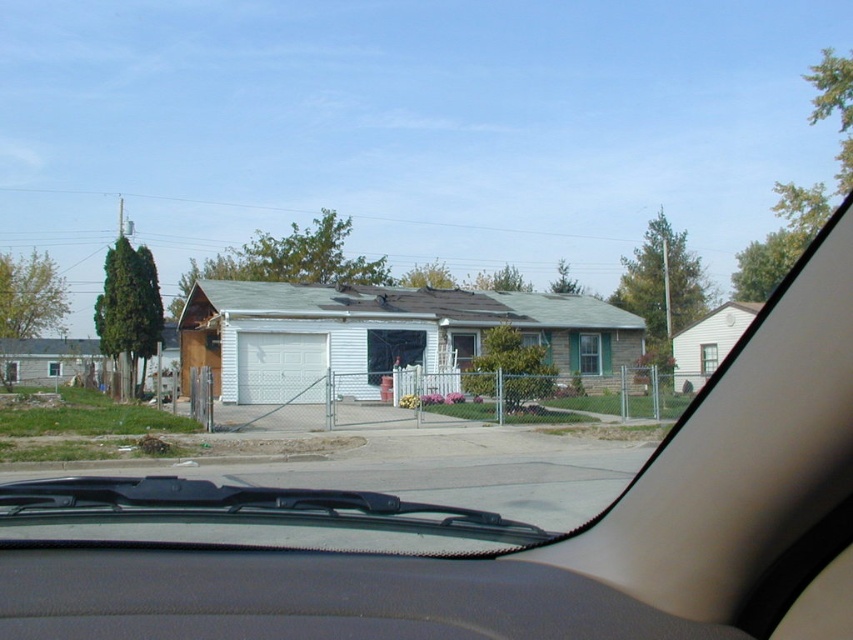
Between point (440, 586) and point (190, 364), which one is positioned in front?

Point (440, 586)

Can you confirm if gray fabric dashboard at lower center is taller than white painted wood garage at center?

In fact, gray fabric dashboard at lower center may be shorter than white painted wood garage at center.

Which is in front, point (401, 628) or point (305, 394)?

Point (401, 628) is in front.

What are the coordinates of `gray fabric dashboard at lower center` in the screenshot? It's located at (312, 596).

Is matte white car at center bigger than white painted wood garage at center?

Incorrect, matte white car at center is not larger than white painted wood garage at center.

Does matte white car at center have a smaller size compared to white painted wood garage at center?

Yes, matte white car at center is smaller than white painted wood garage at center.

Is point (833, 538) behind point (221, 292)?

No, it is not.

Identify the location of matte white car at center. [x=511, y=525].

Is matte white car at center shorter than gray fabric dashboard at lower center?

In fact, matte white car at center may be taller than gray fabric dashboard at lower center.

In the scene shown: Does matte white car at center have a smaller size compared to gray fabric dashboard at lower center?

No, matte white car at center is not smaller than gray fabric dashboard at lower center.

I want to click on matte white car at center, so click(x=511, y=525).